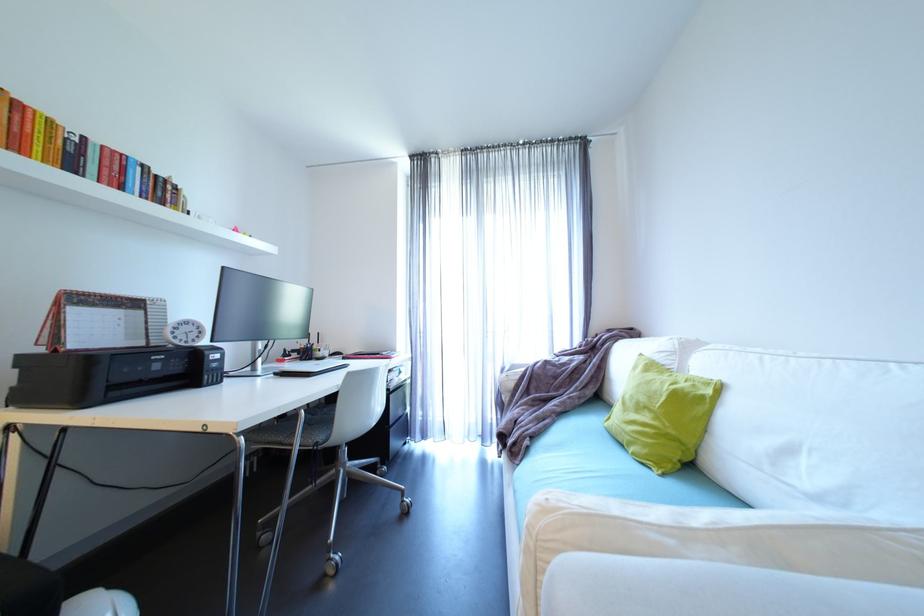
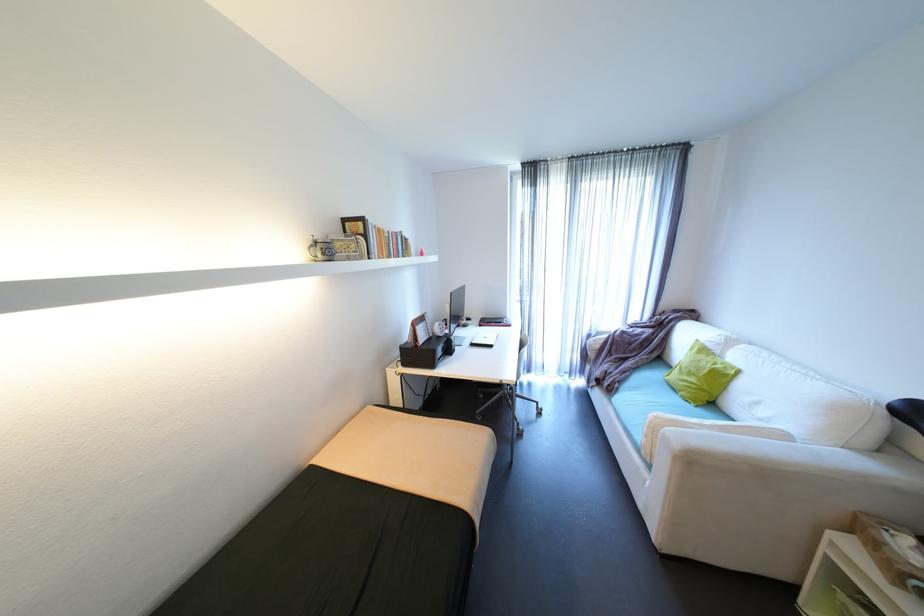
The point at (231, 267) is marked in the first image. Where is the corresponding point in the second image?

(458, 294)